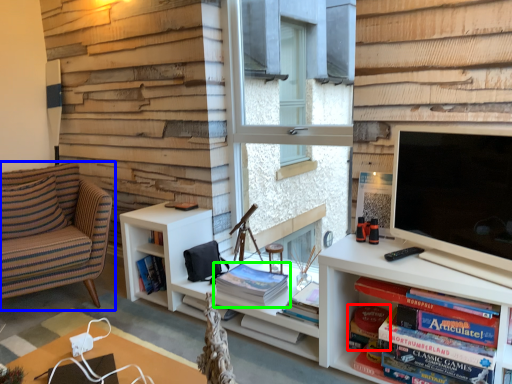
Question: Based on their relative distances, which object is farther from paperback book (highlighted by a red box)? Choose from chair (highlighted by a blue box) and book (highlighted by a green box).

Choices:
 (A) chair
 (B) book

Answer: (A)